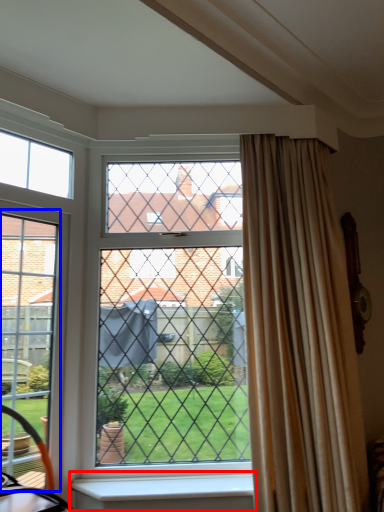
Question: Among these objects, which one is farthest to the camera, window sill (highlighted by a red box) or screen door (highlighted by a blue box)?

Choices:
 (A) window sill
 (B) screen door

Answer: (A)